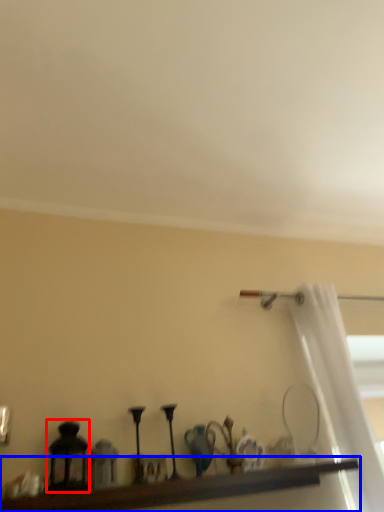
Question: Which object is further to the camera taking this photo, candle holder (highlighted by a red box) or shelf (highlighted by a blue box)?

Choices:
 (A) candle holder
 (B) shelf

Answer: (A)